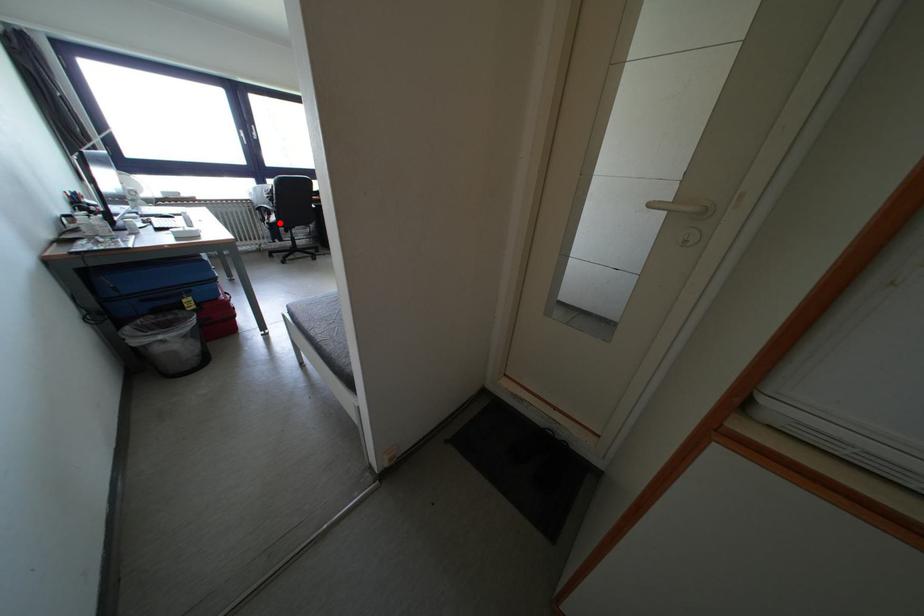
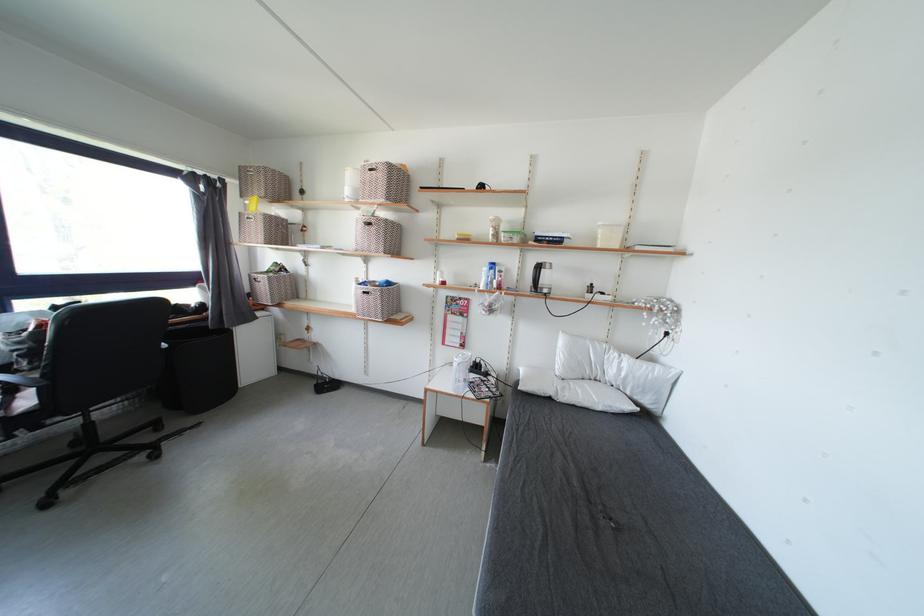
Question: I am providing you with two images of the same scene from different viewpoints. In image1, a red point is highlighted. Considering the same 3D point in image2, which of the following is correct?

Choices:
 (A) It is closer
 (B) It is farther

Answer: (B)